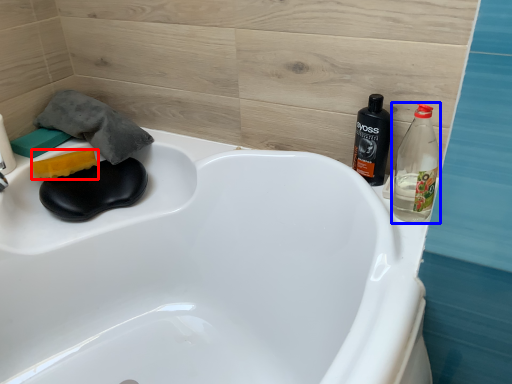
Question: Among these objects, which one is nearest to the camera, soap (highlighted by a red box) or bottle (highlighted by a blue box)?

Choices:
 (A) soap
 (B) bottle

Answer: (B)